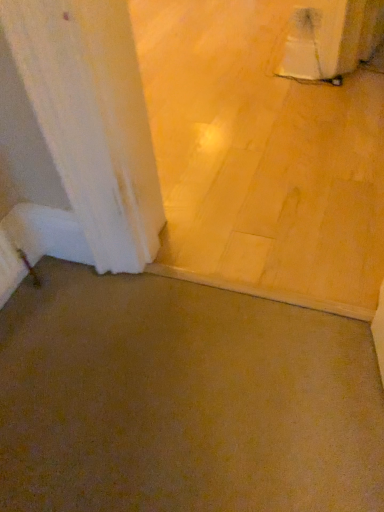
Describe the element at coordinates (261, 158) in the screenshot. I see `brown matte concrete at lower left, positioned as the 1th concrete in back-to-front order` at that location.

Where is `brown matte concrete at lower left, positioned as the 2th concrete in bottom-to-top order`? Image resolution: width=384 pixels, height=512 pixels. brown matte concrete at lower left, positioned as the 2th concrete in bottom-to-top order is located at coordinates (261, 158).

The width and height of the screenshot is (384, 512). I want to click on brown matte concrete at center, placed as the 2th concrete when sorted from back to front, so click(x=183, y=400).

What do you see at coordinates (183, 400) in the screenshot? Image resolution: width=384 pixels, height=512 pixels. I see `brown matte concrete at center, placed as the 2th concrete when sorted from back to front` at bounding box center [183, 400].

Where is `brown matte concrete at lower left, which appears as the 1th concrete when viewed from the top`? The width and height of the screenshot is (384, 512). brown matte concrete at lower left, which appears as the 1th concrete when viewed from the top is located at coordinates point(261,158).

Is brown matte concrete at lower left, positioned as the 1th concrete in back-to-front order, at the right side of brown matte concrete at center, which ranks as the 2th concrete in top-to-bottom order?

Correct, you'll find brown matte concrete at lower left, positioned as the 1th concrete in back-to-front order, to the right of brown matte concrete at center, which ranks as the 2th concrete in top-to-bottom order.

Is the position of brown matte concrete at lower left, positioned as the 2th concrete in bottom-to-top order, more distant than that of brown matte concrete at center, positioned as the first concrete in bottom-to-top order?

Yes.

Considering the points (292, 191) and (41, 437), which point is behind, point (292, 191) or point (41, 437)?

The point (292, 191) is behind.

Consider the image. From the image's perspective, which is below, brown matte concrete at lower left, which appears as the 1th concrete when viewed from the top, or brown matte concrete at center, placed as the 2th concrete when sorted from back to front?

brown matte concrete at center, placed as the 2th concrete when sorted from back to front, is shown below in the image.

From a real-world perspective, is brown matte concrete at lower left, which appears as the 1th concrete when viewed from the top, over brown matte concrete at center, which ranks as the 2th concrete in top-to-bottom order?

Yes.

Based on the photo, between brown matte concrete at lower left, which appears as the 1th concrete when viewed from the top, and brown matte concrete at center, placed as the 2th concrete when sorted from back to front, which one has larger width?

Wider between the two is brown matte concrete at lower left, which appears as the 1th concrete when viewed from the top.

From the picture: Is brown matte concrete at lower left, which appears as the 1th concrete when viewed from the top, shorter than brown matte concrete at center, placed as the 2th concrete when sorted from back to front?

Correct, brown matte concrete at lower left, which appears as the 1th concrete when viewed from the top, is not as tall as brown matte concrete at center, placed as the 2th concrete when sorted from back to front.

Looking at the image, does brown matte concrete at lower left, positioned as the 2th concrete in bottom-to-top order, seem bigger or smaller compared to brown matte concrete at center, placed as the 2th concrete when sorted from back to front?

In the image, brown matte concrete at lower left, positioned as the 2th concrete in bottom-to-top order, appears to be larger than brown matte concrete at center, placed as the 2th concrete when sorted from back to front.

Would you say brown matte concrete at lower left, positioned as the 2th concrete in bottom-to-top order, is outside brown matte concrete at center, which ranks as the 2th concrete in top-to-bottom order?

That's correct, brown matte concrete at lower left, positioned as the 2th concrete in bottom-to-top order, is outside of brown matte concrete at center, which ranks as the 2th concrete in top-to-bottom order.

Are brown matte concrete at lower left, which appears as the 1th concrete when viewed from the top, and brown matte concrete at center, positioned as the first concrete in bottom-to-top order, far apart?

brown matte concrete at lower left, which appears as the 1th concrete when viewed from the top, is actually quite close to brown matte concrete at center, positioned as the first concrete in bottom-to-top order.

Is brown matte concrete at lower left, marked as the second concrete in a front-to-back arrangement, facing away from brown matte concrete at center, positioned as the first concrete in bottom-to-top order?

brown matte concrete at lower left, marked as the second concrete in a front-to-back arrangement, is not turned away from brown matte concrete at center, positioned as the first concrete in bottom-to-top order.

Can you tell me how much brown matte concrete at lower left, marked as the second concrete in a front-to-back arrangement, and brown matte concrete at center, placed as the 2th concrete when sorted from back to front, differ in facing direction?

180 degrees.

How much distance is there between brown matte concrete at lower left, marked as the second concrete in a front-to-back arrangement, and brown matte concrete at center, which ranks as the 2th concrete in top-to-bottom order?

The distance of brown matte concrete at lower left, marked as the second concrete in a front-to-back arrangement, from brown matte concrete at center, which ranks as the 2th concrete in top-to-bottom order, is 66.87 centimeters.

Find the location of a particular element. The height and width of the screenshot is (512, 384). concrete below the brown matte concrete at lower left, positioned as the 1th concrete in back-to-front order (from a real-world perspective) is located at coordinates (183, 400).

Is brown matte concrete at center, placed as the 2th concrete when sorted from back to front, at the left side of brown matte concrete at lower left, which appears as the 1th concrete when viewed from the top?

Correct, you'll find brown matte concrete at center, placed as the 2th concrete when sorted from back to front, to the left of brown matte concrete at lower left, which appears as the 1th concrete when viewed from the top.

Considering the relative positions of brown matte concrete at center, which ranks as the 2th concrete in top-to-bottom order, and brown matte concrete at lower left, marked as the second concrete in a front-to-back arrangement, in the image provided, is brown matte concrete at center, which ranks as the 2th concrete in top-to-bottom order, behind brown matte concrete at lower left, marked as the second concrete in a front-to-back arrangement,?

That is False.

Is point (251, 480) closer to camera compared to point (209, 261)?

Yes, point (251, 480) is in front of point (209, 261).

From the image's perspective, is brown matte concrete at center, positioned as the first concrete in bottom-to-top order, on top of brown matte concrete at lower left, marked as the second concrete in a front-to-back arrangement?

No, from the image's perspective, brown matte concrete at center, positioned as the first concrete in bottom-to-top order, is not on top of brown matte concrete at lower left, marked as the second concrete in a front-to-back arrangement.

From a real-world perspective, is brown matte concrete at center, placed as the 2th concrete when sorted from back to front, under brown matte concrete at lower left, positioned as the 2th concrete in bottom-to-top order?

Indeed, from a real-world perspective, brown matte concrete at center, placed as the 2th concrete when sorted from back to front, is positioned beneath brown matte concrete at lower left, positioned as the 2th concrete in bottom-to-top order.

In the scene shown: Considering the relative sizes of brown matte concrete at center, which ranks as the 2th concrete in top-to-bottom order, and brown matte concrete at lower left, positioned as the 2th concrete in bottom-to-top order, in the image provided, is brown matte concrete at center, which ranks as the 2th concrete in top-to-bottom order, thinner than brown matte concrete at lower left, positioned as the 2th concrete in bottom-to-top order,?

Yes, brown matte concrete at center, which ranks as the 2th concrete in top-to-bottom order, is thinner than brown matte concrete at lower left, positioned as the 2th concrete in bottom-to-top order.

Between brown matte concrete at center, placed as the 2th concrete when sorted from back to front, and brown matte concrete at lower left, marked as the second concrete in a front-to-back arrangement, which one has more height?

With more height is brown matte concrete at center, placed as the 2th concrete when sorted from back to front.

Looking at the image, does brown matte concrete at center, which ranks as the 2th concrete in top-to-bottom order, seem bigger or smaller compared to brown matte concrete at lower left, marked as the second concrete in a front-to-back arrangement?

Considering their sizes, brown matte concrete at center, which ranks as the 2th concrete in top-to-bottom order, takes up less space than brown matte concrete at lower left, marked as the second concrete in a front-to-back arrangement.

Choose the correct answer: Is brown matte concrete at center, placed as the 2th concrete when sorted from back to front, inside brown matte concrete at lower left, positioned as the 2th concrete in bottom-to-top order, or outside it?

brown matte concrete at center, placed as the 2th concrete when sorted from back to front, lies outside brown matte concrete at lower left, positioned as the 2th concrete in bottom-to-top order.

Is brown matte concrete at center, which ranks as the 2th concrete in top-to-bottom order, not close to brown matte concrete at lower left, positioned as the 2th concrete in bottom-to-top order?

brown matte concrete at center, which ranks as the 2th concrete in top-to-bottom order, is near brown matte concrete at lower left, positioned as the 2th concrete in bottom-to-top order, not far away.

Could you tell me if brown matte concrete at center, positioned as the first concrete in bottom-to-top order, is facing brown matte concrete at lower left, marked as the second concrete in a front-to-back arrangement?

Yes, brown matte concrete at center, positioned as the first concrete in bottom-to-top order, is oriented towards brown matte concrete at lower left, marked as the second concrete in a front-to-back arrangement.

Where is `concrete to the left of brown matte concrete at lower left, which appears as the 1th concrete when viewed from the top`? The image size is (384, 512). concrete to the left of brown matte concrete at lower left, which appears as the 1th concrete when viewed from the top is located at coordinates (183, 400).

Where is `concrete below the brown matte concrete at lower left, positioned as the 1th concrete in back-to-front order (from the image's perspective)`? The width and height of the screenshot is (384, 512). concrete below the brown matte concrete at lower left, positioned as the 1th concrete in back-to-front order (from the image's perspective) is located at coordinates (183, 400).

Locate an element on the screen. concrete that is behind the brown matte concrete at center, placed as the 2th concrete when sorted from back to front is located at coordinates (261, 158).